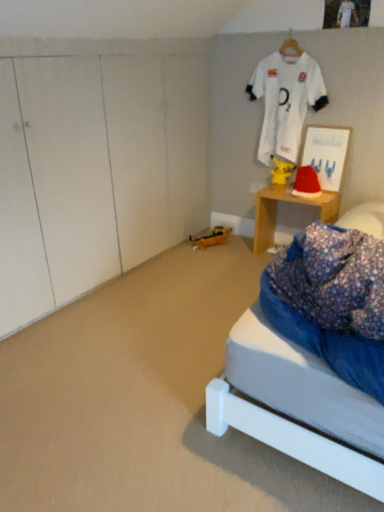
Find the location of `vacant area that lies in front of yellow matte pikachu at center`. vacant area that lies in front of yellow matte pikachu at center is located at coordinates (284, 187).